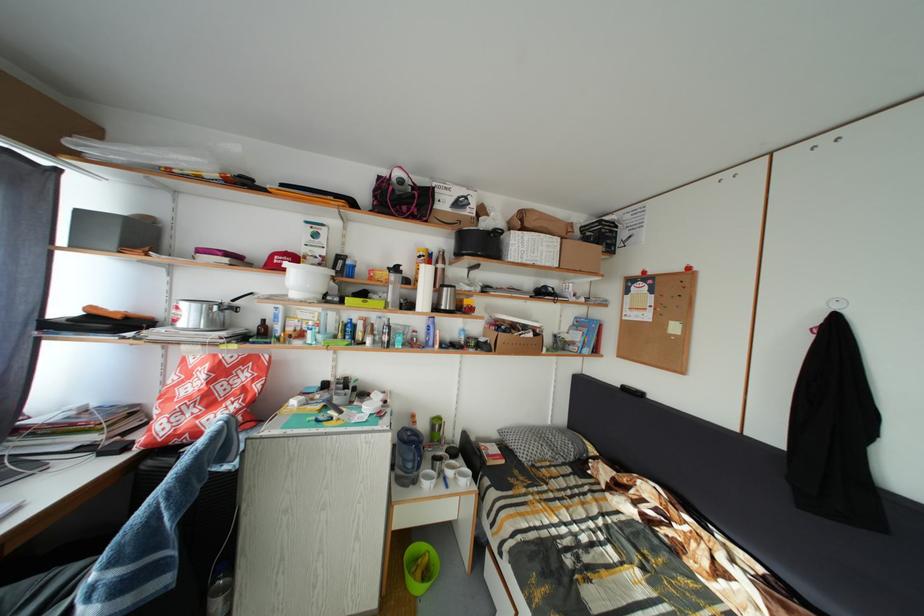
The width and height of the screenshot is (924, 616). What do you see at coordinates (241, 296) in the screenshot?
I see `the silver pot handle` at bounding box center [241, 296].